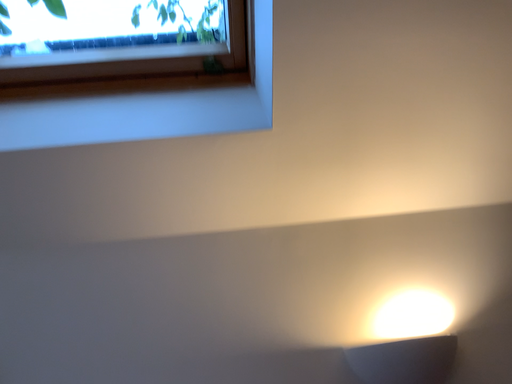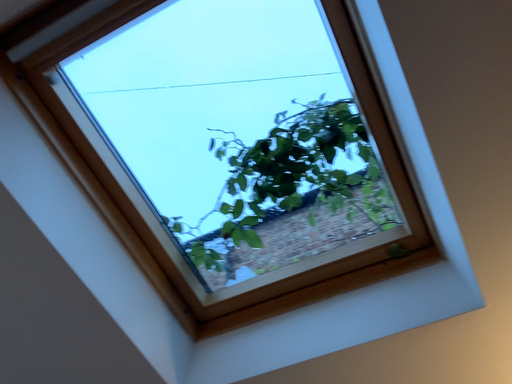
Question: Which way did the camera rotate in the video?

Choices:
 (A) rotated left
 (B) rotated right

Answer: (A)